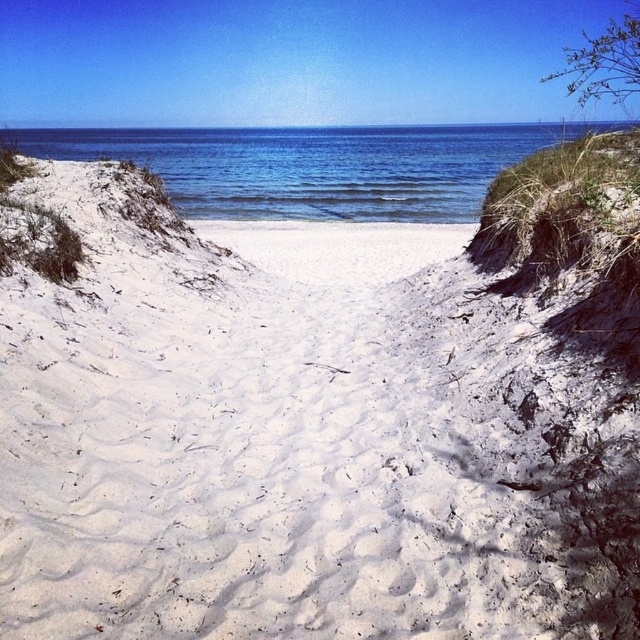
You are standing on the white sandy beach at center and want to reach the blue water at center. Which direction should you go to get there?

Since the blue water at center is bigger than the white sandy beach at center, you should walk forward towards the blue water at center to reach it.

Consider the image. You are standing on the white sandy beach at center and want to reach the blue water at center. According to the scene description, which direction should you move towards?

The blue water at center is located above the white sandy beach at center, so you should move upwards to reach it.